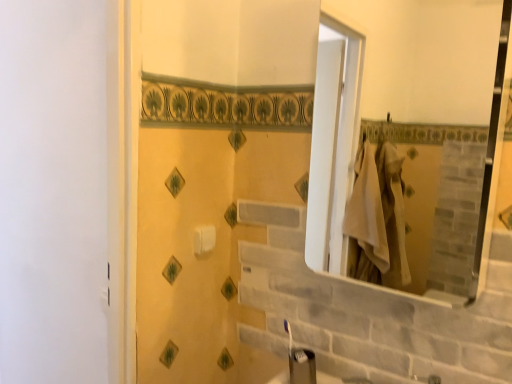
The image size is (512, 384). What do you see at coordinates (204, 239) in the screenshot?
I see `white matte toilet paper at center` at bounding box center [204, 239].

Find the location of a particular element. The width and height of the screenshot is (512, 384). white matte toilet paper at center is located at coordinates (204, 239).

The height and width of the screenshot is (384, 512). Find the location of `white glossy mirror at upper right`. white glossy mirror at upper right is located at coordinates (422, 130).

What do you see at coordinates (422, 130) in the screenshot?
I see `white glossy mirror at upper right` at bounding box center [422, 130].

You are a GUI agent. You are given a task and a screenshot of the screen. Output one action in this format:
    pyautogui.click(x=<x>, y=<y>)
    Task: Click on the white matte toilet paper at center
    
    Given the screenshot: What is the action you would take?
    pyautogui.click(x=204, y=239)

Based on their positions, is white glossy mirror at upper right located to the left or right of white matte toilet paper at center?

From the image, it's evident that white glossy mirror at upper right is to the right of white matte toilet paper at center.

Based on the photo, is white glossy mirror at upper right positioned in front of white matte toilet paper at center?

Yes, it is.

Does point (457, 19) come in front of point (207, 233)?

No, (457, 19) is further to viewer.

From the image's perspective, does white glossy mirror at upper right appear lower than white matte toilet paper at center?

Incorrect, from the image's perspective, white glossy mirror at upper right is higher than white matte toilet paper at center.

From a real-world perspective, is white glossy mirror at upper right positioned over white matte toilet paper at center based on gravity?

Indeed, from a real-world perspective, white glossy mirror at upper right stands above white matte toilet paper at center.

Based on the photo, between white glossy mirror at upper right and white matte toilet paper at center, which one has smaller width?

With smaller width is white matte toilet paper at center.

Is white glossy mirror at upper right shorter than white matte toilet paper at center?

In fact, white glossy mirror at upper right may be taller than white matte toilet paper at center.

Is white glossy mirror at upper right smaller than white matte toilet paper at center?

No.

Based on the photo, is white glossy mirror at upper right outside of white matte toilet paper at center?

white glossy mirror at upper right is positioned outside white matte toilet paper at center.

Is white glossy mirror at upper right touching white matte toilet paper at center?

There is a gap between white glossy mirror at upper right and white matte toilet paper at center.

Is white glossy mirror at upper right looking in the opposite direction of white matte toilet paper at center?

white glossy mirror at upper right is not turned away from white matte toilet paper at center.

The height and width of the screenshot is (384, 512). I want to click on mirror on the right of white matte toilet paper at center, so click(x=422, y=130).

Is white matte toilet paper at center to the right of white glossy mirror at upper right from the viewer's perspective?

Incorrect, white matte toilet paper at center is not on the right side of white glossy mirror at upper right.

Is white matte toilet paper at center in front of white glossy mirror at upper right?

No, it is behind white glossy mirror at upper right.

Which is closer, (202, 229) or (473, 14)?

The point (202, 229) is more forward.

From the image's perspective, is white matte toilet paper at center located beneath white glossy mirror at upper right?

Yes, from the image's perspective, white matte toilet paper at center is beneath white glossy mirror at upper right.

From a real-world perspective, between white matte toilet paper at center and white glossy mirror at upper right, who is vertically lower?

white matte toilet paper at center.

Is white matte toilet paper at center thinner than white glossy mirror at upper right?

Yes, white matte toilet paper at center is thinner than white glossy mirror at upper right.

Does white matte toilet paper at center have a lesser height compared to white glossy mirror at upper right?

Correct, white matte toilet paper at center is not as tall as white glossy mirror at upper right.

Is white matte toilet paper at center bigger or smaller than white glossy mirror at upper right?

Clearly, white matte toilet paper at center is smaller in size than white glossy mirror at upper right.

Is white glossy mirror at upper right inside white matte toilet paper at center?

Definitely not — white glossy mirror at upper right is not inside white matte toilet paper at center.

Is white matte toilet paper at center next to white glossy mirror at upper right and touching it?

white matte toilet paper at center is not next to white glossy mirror at upper right, and they're not touching.

Is white matte toilet paper at center facing towards white glossy mirror at upper right?

No, white matte toilet paper at center is not oriented towards white glossy mirror at upper right.

Based on the photo, how different are the orientations of white matte toilet paper at center and white glossy mirror at upper right in degrees?

They differ by 90 degrees in their facing directions.

You are a GUI agent. You are given a task and a screenshot of the screen. Output one action in this format:
    pyautogui.click(x=<x>, y=<y>)
    Task: Click on the toilet paper behind the white glossy mirror at upper right
    Image resolution: width=512 pixels, height=384 pixels.
    Given the screenshot: What is the action you would take?
    pyautogui.click(x=204, y=239)

In the image, there is a white matte toilet paper at center. Where is `mirror above it (from the image's perspective)`? The height and width of the screenshot is (384, 512). mirror above it (from the image's perspective) is located at coordinates (422, 130).

The width and height of the screenshot is (512, 384). I want to click on toilet paper below the white glossy mirror at upper right (from a real-world perspective), so click(204, 239).